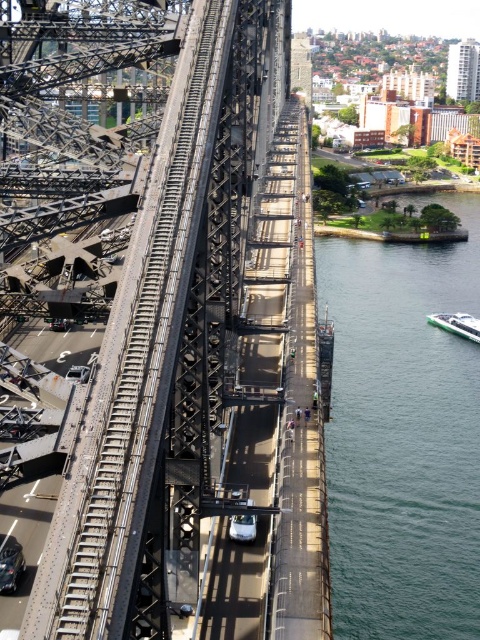
You are a photographer planning to capture a wide shot of the Sydney Harbour Bridge. You notice the green water at lower right and the white glossy boat at lower right in your frame. Based on their widths, which object will occupy more space horizontally in the photo?

The green water at lower right will occupy more space horizontally in the photo because its width surpasses that of the white glossy boat at lower right.

You are a drone operator planning to capture aerial footage of the black steel bridge at center and the green water at lower right. Given that the drone can only focus on one object at a time, which object should you prioritize to ensure it fills most of the frame?

The black steel bridge at center should be prioritized because it is larger in size than the green water at lower right, making it more suitable to fill the frame.